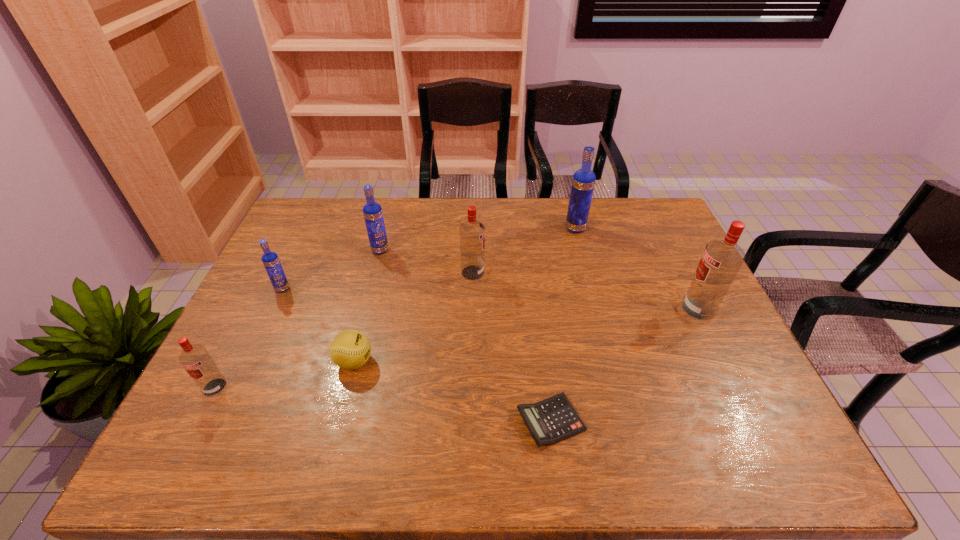
Identify the location of the fifth vodka from left to right. (583, 181).

Identify the location of the farthest blue vodka. The image size is (960, 540). (583, 181).

Image resolution: width=960 pixels, height=540 pixels. What are the coordinates of `the rightmost red vodka` in the screenshot? It's located at (721, 260).

You are a GUI agent. You are given a task and a screenshot of the screen. Output one action in this format:
    pyautogui.click(x=<x>, y=<y>)
    Task: Click on the rightmost vodka
    The width and height of the screenshot is (960, 540).
    Given the screenshot: What is the action you would take?
    pyautogui.click(x=721, y=260)

Identify the location of the second farthest vodka. (372, 211).

The height and width of the screenshot is (540, 960). Identify the location of the second biggest blue vodka. (372, 211).

Find the location of a particular element. The width and height of the screenshot is (960, 540). the fourth object from right to left is located at coordinates (472, 232).

This screenshot has width=960, height=540. Find the location of `the second red vodka from right to left`. the second red vodka from right to left is located at coordinates (472, 232).

At what (x,y) coordinates should I click in order to perform the action: click on the smallest blue vodka. Please return your answer as a coordinate pair (x, y). Looking at the image, I should click on 271,262.

In order to click on the fifth nearest object in this screenshot , I will do `click(271, 262)`.